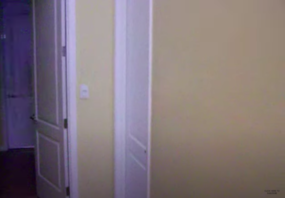
The width and height of the screenshot is (285, 198). I want to click on bevels on doors, so click(x=134, y=134), click(x=58, y=86), click(x=44, y=134).